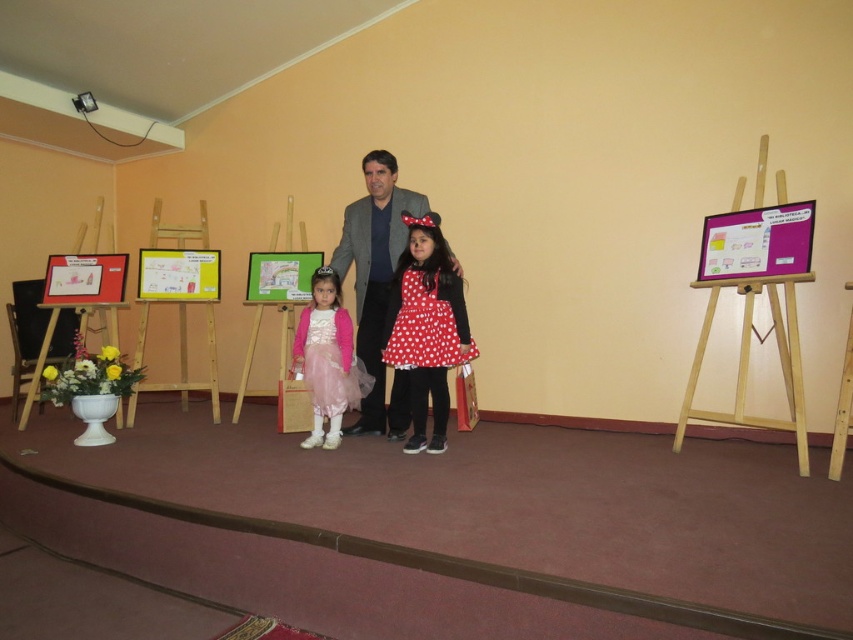
You are a photographer setting up for a photoshoot in this classroom. You need to position a small stool between the wooden easel at right and the polka dot fabric dress at center so that it doesn t block the view of either object. Where should you place the stool?

The wooden easel at right is much taller than the polka dot fabric dress at center, so placing the stool closer to the base of the wooden easel at right would ensure it doesn t block the view of the shorter polka dot fabric dress at center.

You are an interior designer assessing the classroom layout. The wooden easel at right and the polka dot fabric dress at center are both in your view. Which object is positioned higher relative to the other?

The wooden easel at right is positioned higher than the polka dot fabric dress at center.